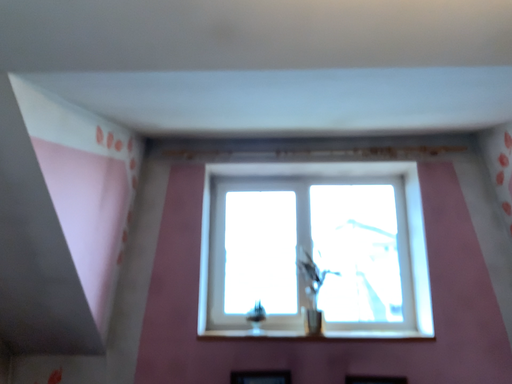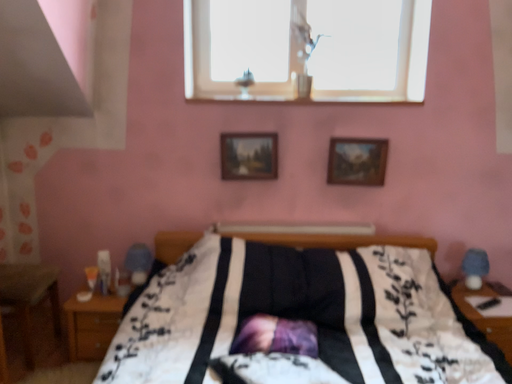
Question: Which way did the camera rotate in the video?

Choices:
 (A) rotated upward
 (B) rotated downward

Answer: (B)